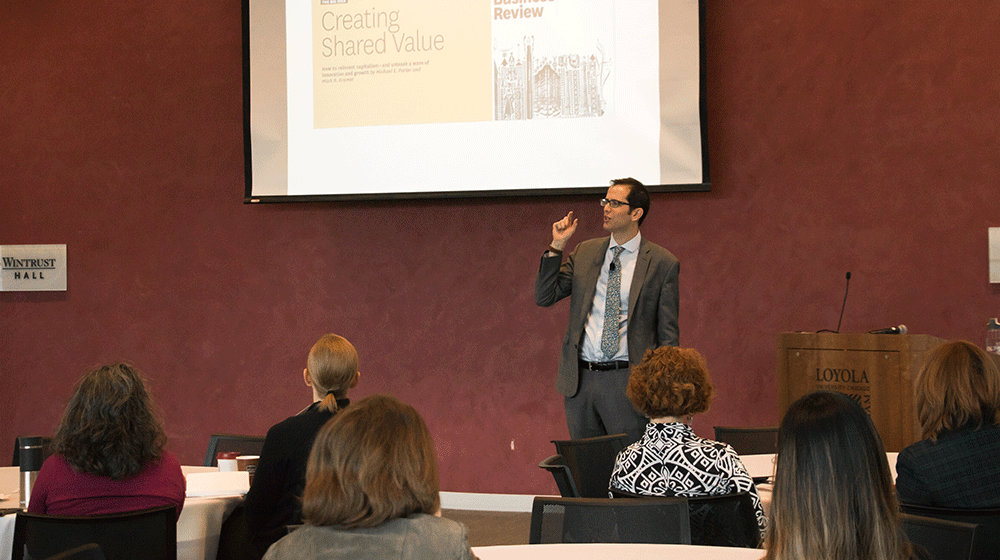
The height and width of the screenshot is (560, 1000). What are the coordinates of `wall sign` in the screenshot? It's located at (49, 270).